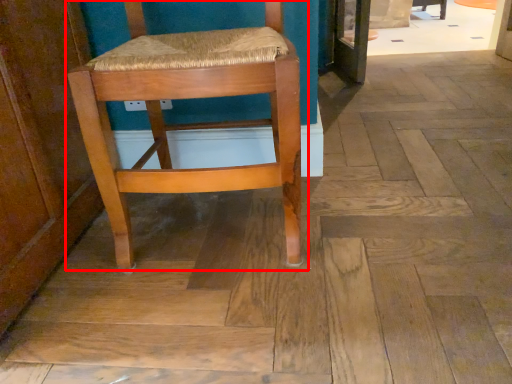
Question: From the image's perspective, where is chair (annotated by the red box) located in relation to chair in the image?

Choices:
 (A) above
 (B) below

Answer: (B)